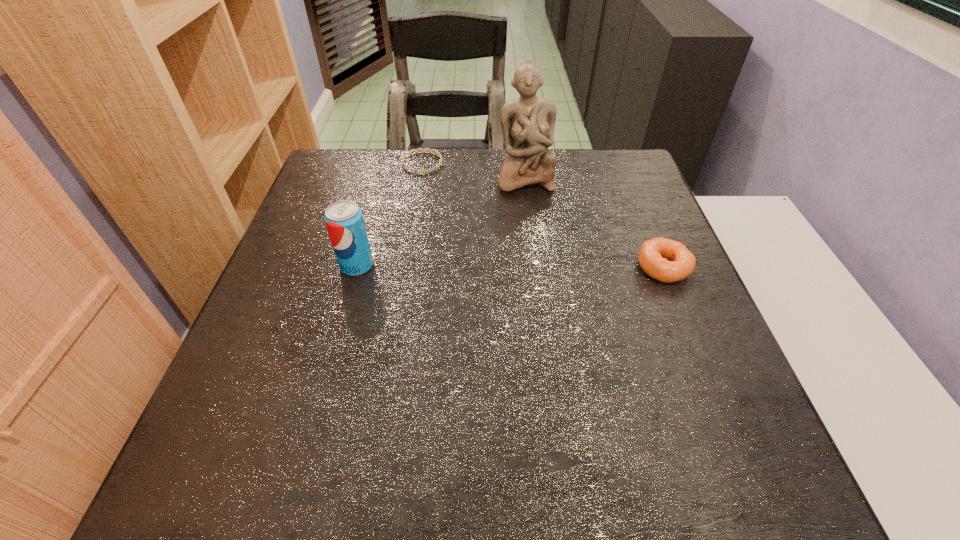
You are a GUI agent. You are given a task and a screenshot of the screen. Output one action in this format:
    pyautogui.click(x=<x>, y=<y>)
    Task: Click on the vacant space on the desktop that is between the soda can and the rightmost object and is positioned on the front-facing side of the tallest object
    Image resolution: width=960 pixels, height=540 pixels.
    Given the screenshot: What is the action you would take?
    pyautogui.click(x=541, y=266)

Locate an element on the screen. Image resolution: width=960 pixels, height=540 pixels. vacant space on the desktop that is between the third shortest object and the third tallest object and is positioned on the surface of the second object from left to right showing star-shaped elements is located at coordinates (464, 266).